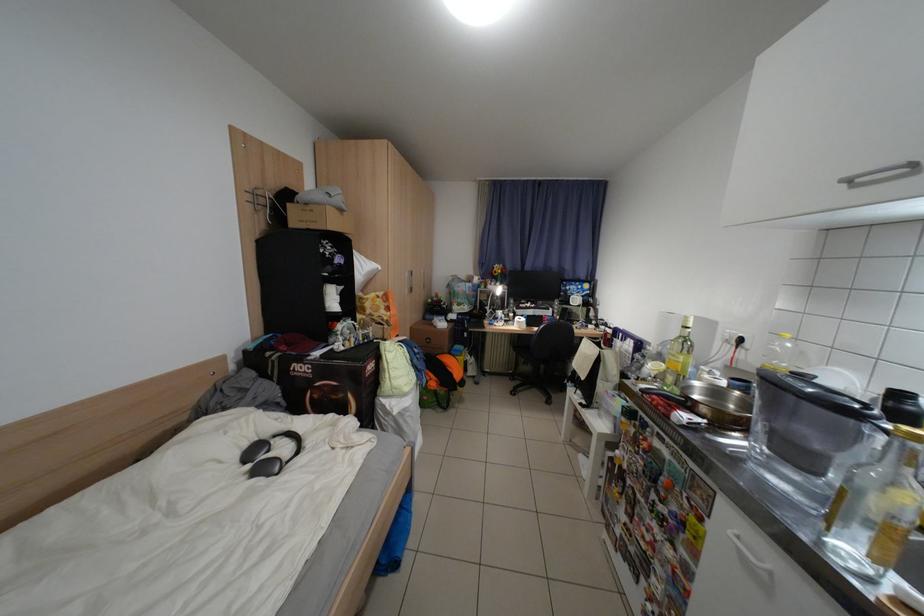
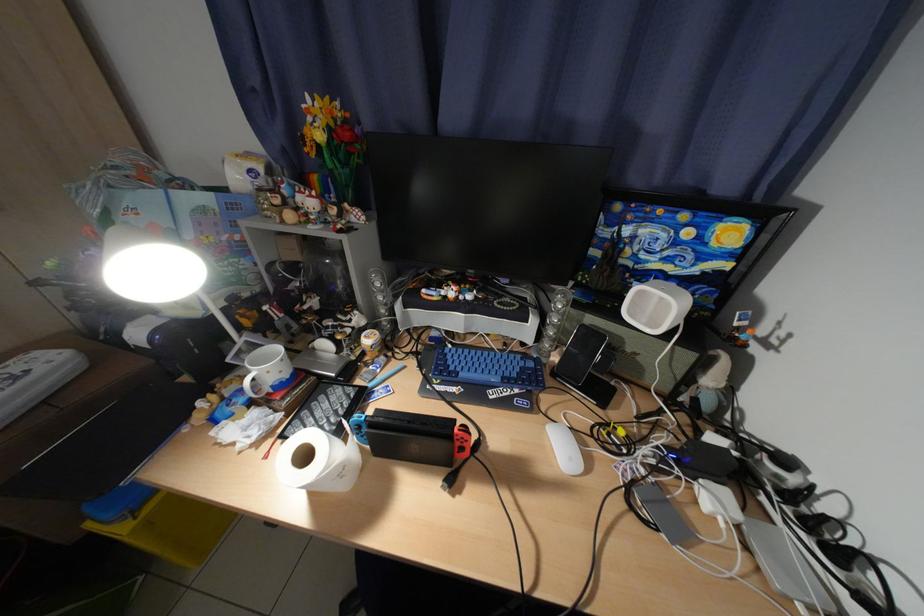
Locate, in the second image, the point that corresponds to pixel 512 273 in the first image.

(331, 138)